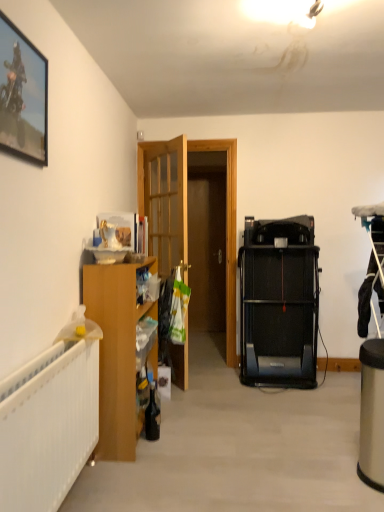
Question: Is metallic framed picture at upper left surrounding black plastic treadmill at center-right?

Choices:
 (A) yes
 (B) no

Answer: (B)

Question: Is metallic framed picture at upper left to the right of black plastic treadmill at center-right from the viewer's perspective?

Choices:
 (A) no
 (B) yes

Answer: (A)

Question: Is metallic framed picture at upper left facing away from black plastic treadmill at center-right?

Choices:
 (A) yes
 (B) no

Answer: (B)

Question: From a real-world perspective, is metallic framed picture at upper left physically above black plastic treadmill at center-right?

Choices:
 (A) no
 (B) yes

Answer: (B)

Question: Is metallic framed picture at upper left positioned in front of black plastic treadmill at center-right?

Choices:
 (A) yes
 (B) no

Answer: (A)

Question: In the image, is wooden cabinet at left positioned in front of or behind wooden door at center?

Choices:
 (A) behind
 (B) front

Answer: (B)

Question: From a real-world perspective, is wooden cabinet at left above or below wooden door at center?

Choices:
 (A) below
 (B) above

Answer: (A)

Question: Based on their sizes in the image, would you say wooden cabinet at left is bigger or smaller than wooden door at center?

Choices:
 (A) small
 (B) big

Answer: (B)

Question: From the image's perspective, relative to wooden door at center, is wooden cabinet at left above or below?

Choices:
 (A) above
 (B) below

Answer: (B)

Question: Considering the positions of point pos(99,441) and point pos(26,124), is point pos(99,441) closer or farther from the camera than point pos(26,124)?

Choices:
 (A) closer
 (B) farther

Answer: (B)

Question: Is wooden cabinet at left wider or thinner than metallic framed picture at upper left?

Choices:
 (A) wide
 (B) thin

Answer: (A)

Question: From the image's perspective, relative to metallic framed picture at upper left, is wooden cabinet at left above or below?

Choices:
 (A) below
 (B) above

Answer: (A)

Question: Considering the relative positions of wooden cabinet at left and metallic framed picture at upper left in the image provided, is wooden cabinet at left to the left or to the right of metallic framed picture at upper left?

Choices:
 (A) left
 (B) right

Answer: (B)

Question: From a real-world perspective, is black plastic treadmill at center-right physically located above or below wooden cabinet at left?

Choices:
 (A) above
 (B) below

Answer: (A)

Question: From the image's perspective, is black plastic treadmill at center-right positioned above or below wooden cabinet at left?

Choices:
 (A) above
 (B) below

Answer: (A)